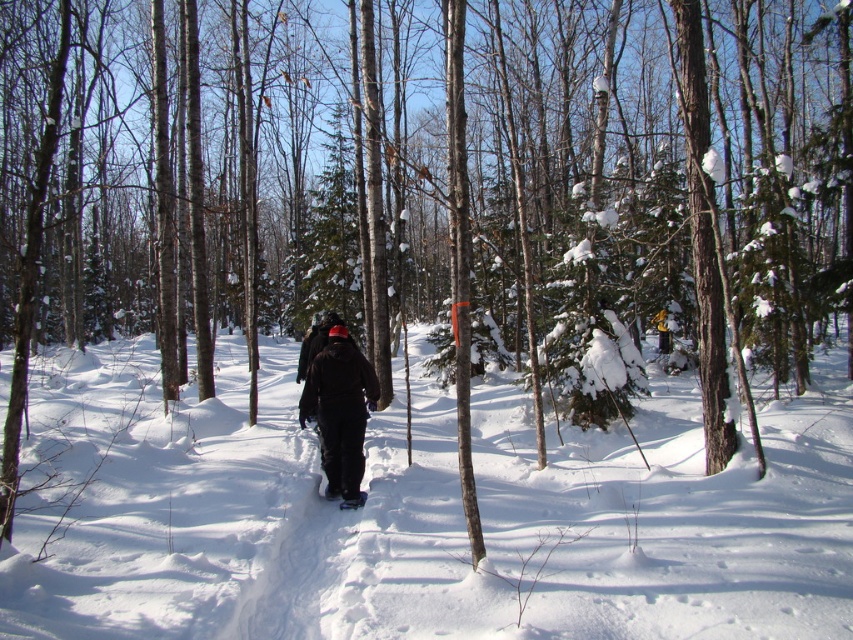
You are planning to walk across a frozen lake in the winter scene described. You have two snowshoes available, the white rubber snowshoe at center and the white matte snowshoe at center. Which one should you choose to distribute your weight more effectively to avoid breaking through the ice?

The white matte snowshoe at center should be chosen because it is larger in size compared to the white rubber snowshoe at center, which helps distribute weight more effectively over the ice.

You are planning to take a photo of the winter scene. You want to ensure both the black fabric skier at center and the white matte snowshoe at center are clearly visible in the frame. Which object will appear wider in the photo?

The black fabric skier at center will appear wider in the photo since its width surpasses that of the white matte snowshoe at center.

You are an explorer in the winter forest and see the white fluffy snow at center and the white rubber snowshoe at center. Which object is located to the right of the other?

The white fluffy snow at center is to the right of the white rubber snowshoe at center.